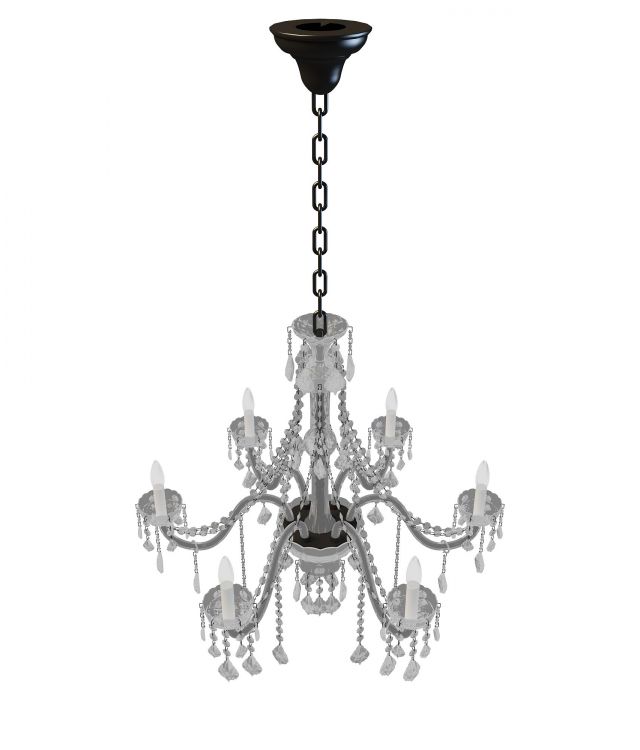
Identify the location of centerpiece. (316, 554).